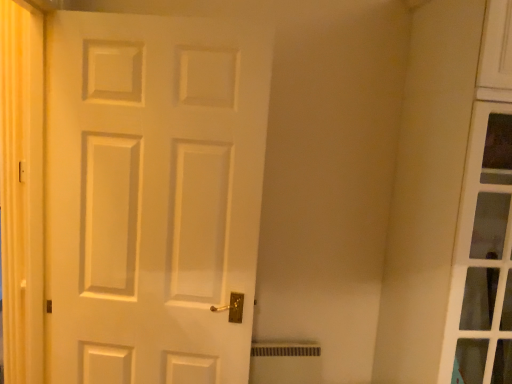
Describe the element at coordinates (152, 196) in the screenshot. Image resolution: width=512 pixels, height=384 pixels. I see `white matte door at center` at that location.

Measure the distance between white matte door at center and camera.

A distance of 4.60 feet exists between white matte door at center and camera.

Find the location of a particular element. This screenshot has width=512, height=384. white matte door at center is located at coordinates (152, 196).

What do you see at coordinates (21, 189) in the screenshot? The width and height of the screenshot is (512, 384). I see `yellow fabric curtain at left` at bounding box center [21, 189].

Measure the distance between yellow fabric curtain at left and camera.

yellow fabric curtain at left and camera are 4.91 feet apart.

Find the location of a particular element. yellow fabric curtain at left is located at coordinates (21, 189).

Locate an element on the screen. white matte door at center is located at coordinates (152, 196).

Considering the positions of objects yellow fabric curtain at left and white matte door at center in the image provided, who is more to the right, yellow fabric curtain at left or white matte door at center?

white matte door at center is more to the right.

Is yellow fabric curtain at left positioned in front of white matte door at center?

Yes, yellow fabric curtain at left is closer to the camera.

Considering the points (38, 19) and (119, 67), which point is behind, point (38, 19) or point (119, 67)?

The point (38, 19) is farther from the camera.

From the image's perspective, is yellow fabric curtain at left above or below white matte door at center?

Clearly, from the image's perspective, yellow fabric curtain at left is above white matte door at center.

From a real-world perspective, which object rests below the other?

white matte door at center, from a real-world perspective.

Considering the relative sizes of yellow fabric curtain at left and white matte door at center in the image provided, is yellow fabric curtain at left thinner than white matte door at center?

Yes.

Considering the relative sizes of yellow fabric curtain at left and white matte door at center in the image provided, is yellow fabric curtain at left taller than white matte door at center?

Correct, yellow fabric curtain at left is much taller as white matte door at center.

Which of these two, yellow fabric curtain at left or white matte door at center, is smaller?

Smaller between the two is yellow fabric curtain at left.

Is yellow fabric curtain at left inside or outside of white matte door at center?

yellow fabric curtain at left is not inside white matte door at center, it's outside.

Are yellow fabric curtain at left and white matte door at center far apart?

They are positioned close to each other.

Is yellow fabric curtain at left turned away from white matte door at center?

Yes.

What's the angular difference between yellow fabric curtain at left and white matte door at center's facing directions?

The angular difference between yellow fabric curtain at left and white matte door at center is 104 degrees.

The width and height of the screenshot is (512, 384). Identify the location of door below the yellow fabric curtain at left (from a real-world perspective). (152, 196).

Which is more to the right, white matte door at center or yellow fabric curtain at left?

From the viewer's perspective, white matte door at center appears more on the right side.

Is white matte door at center in front of or behind yellow fabric curtain at left in the image?

white matte door at center is behind yellow fabric curtain at left.

From the picture: Which point is more forward, (202, 298) or (18, 31)?

Positioned in front is point (18, 31).

From the image's perspective, which one is positioned lower, white matte door at center or yellow fabric curtain at left?

white matte door at center, from the image's perspective.

From a real-world perspective, which is physically below, white matte door at center or yellow fabric curtain at left?

From a 3D spatial view, white matte door at center is below.

Which of these two, white matte door at center or yellow fabric curtain at left, is thinner?

yellow fabric curtain at left is thinner.

Is white matte door at center shorter than yellow fabric curtain at left?

Yes, white matte door at center is shorter than yellow fabric curtain at left.

Does white matte door at center have a smaller size compared to yellow fabric curtain at left?

No, white matte door at center is not smaller than yellow fabric curtain at left.

Could yellow fabric curtain at left be considered to be inside white matte door at center?

That's incorrect, yellow fabric curtain at left is not inside white matte door at center.

Is white matte door at center next to yellow fabric curtain at left and touching it?

No, white matte door at center is not with yellow fabric curtain at left.

Does white matte door at center turn towards yellow fabric curtain at left?

Yes, white matte door at center is oriented towards yellow fabric curtain at left.

What's the angular difference between white matte door at center and yellow fabric curtain at left's facing directions?

104 degrees.

The image size is (512, 384). I want to click on curtain lying above the white matte door at center (from the image's perspective), so click(21, 189).

Identify the location of door that appears on the right of yellow fabric curtain at left. (152, 196).

At what (x,y) coordinates should I click in order to perform the action: click on curtain on the left of white matte door at center. Please return your answer as a coordinate pair (x, y). Looking at the image, I should click on (21, 189).